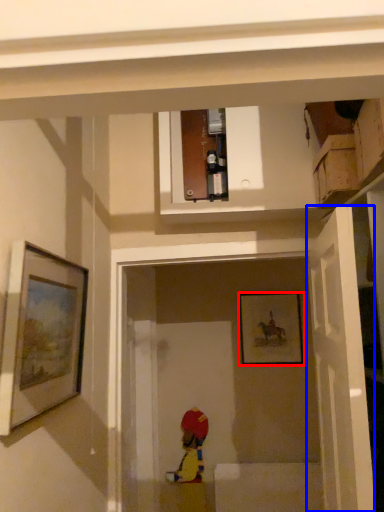
Question: Which point is closer to the camera, picture frame (highlighted by a red box) or door (highlighted by a blue box)?

Choices:
 (A) picture frame
 (B) door

Answer: (B)